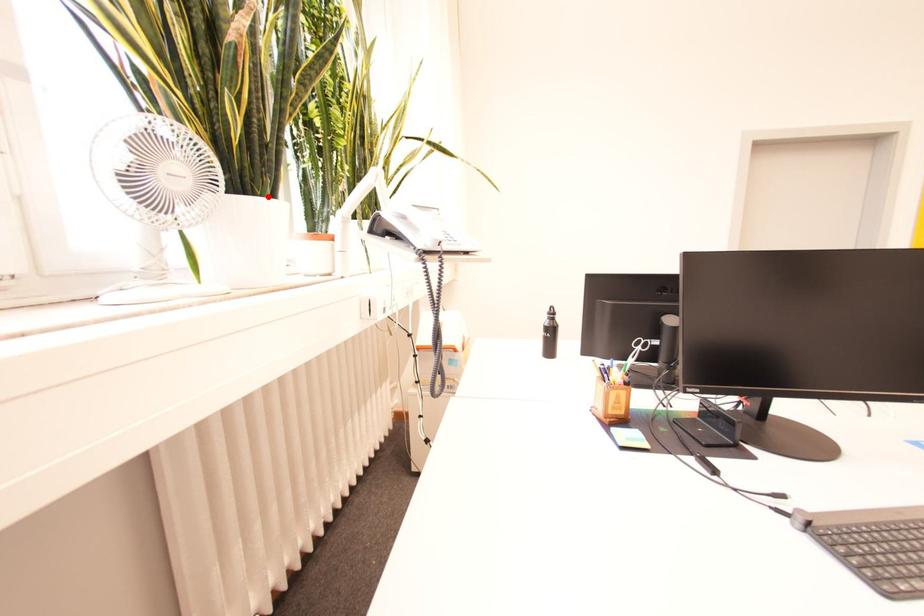
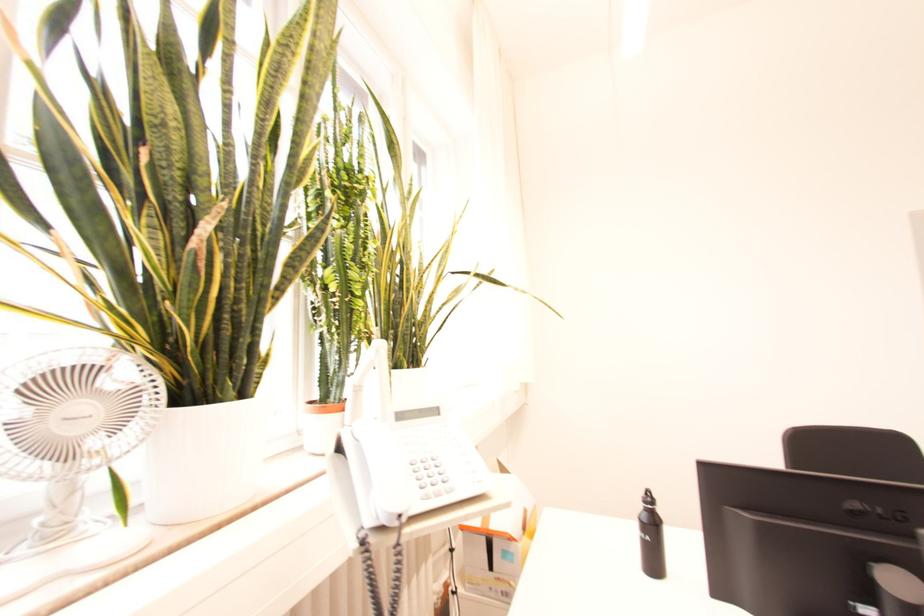
Locate, in the second image, the point that corresponds to the highlighted location in the first image.

(227, 402)